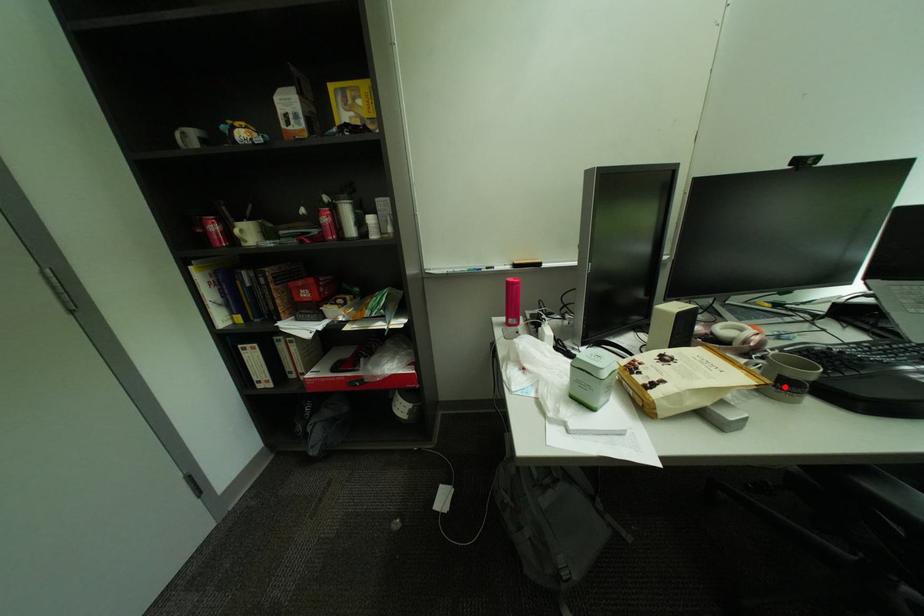
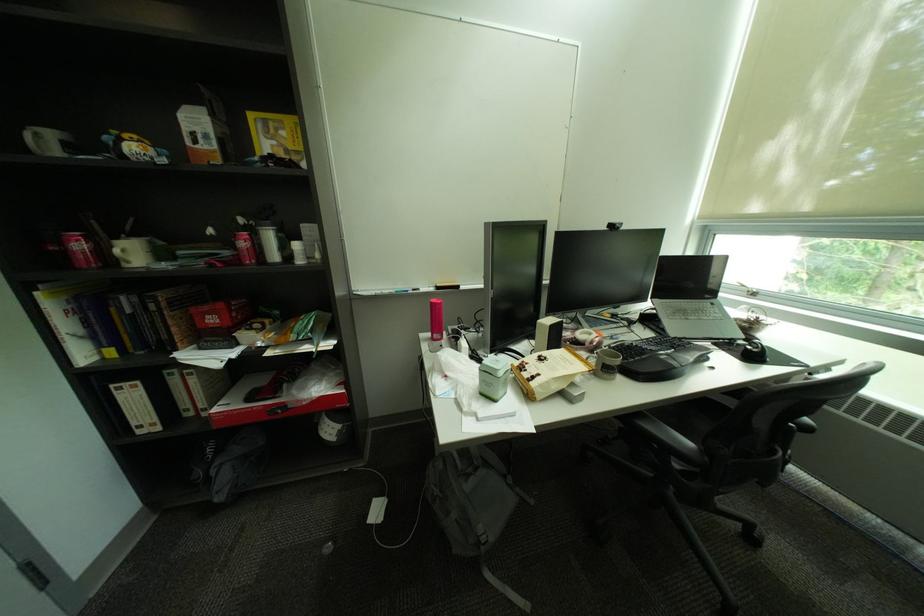
In the second image, find the point that corresponds to the highlighted location in the first image.

(613, 371)